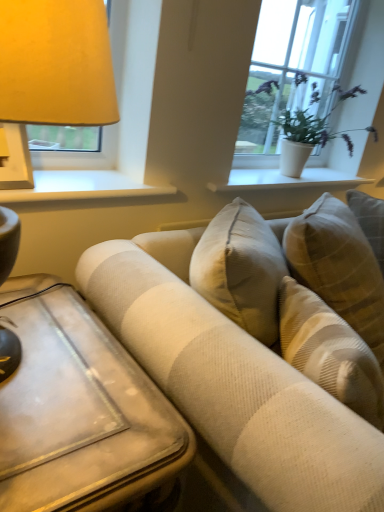
Question: Can you confirm if beige textured couch at center is shorter than white ceramic vase at upper center, which appears as the 1th window sill when viewed from the right?

Choices:
 (A) yes
 (B) no

Answer: (B)

Question: Is beige textured couch at center further to camera compared to white ceramic vase at upper center, the 2th window sill viewed from the front?

Choices:
 (A) yes
 (B) no

Answer: (B)

Question: Can you see beige textured couch at center touching white ceramic vase at upper center, marked as the first window sill in a back-to-front arrangement?

Choices:
 (A) no
 (B) yes

Answer: (A)

Question: Considering the relative positions of beige textured couch at center and white ceramic vase at upper center, the 2th window sill viewed from the front, in the image provided, is beige textured couch at center to the left of white ceramic vase at upper center, the 2th window sill viewed from the front, from the viewer's perspective?

Choices:
 (A) yes
 (B) no

Answer: (B)

Question: Is beige textured couch at center positioned in front of white ceramic vase at upper center, which is the second window sill in left-to-right order?

Choices:
 (A) yes
 (B) no

Answer: (A)

Question: Looking at their shapes, would you say white textured plant at upper right is wider or thinner than beige textured couch at center?

Choices:
 (A) thin
 (B) wide

Answer: (A)

Question: Is point coord(269,130) closer or farther from the camera than point coord(107,304)?

Choices:
 (A) closer
 (B) farther

Answer: (B)

Question: Based on their positions, is white textured plant at upper right located to the left or right of beige textured couch at center?

Choices:
 (A) left
 (B) right

Answer: (A)

Question: From the image's perspective, is white textured plant at upper right located above or below beige textured couch at center?

Choices:
 (A) above
 (B) below

Answer: (A)

Question: In terms of width, does white textured plant at upper right look wider or thinner when compared to white ceramic vase at upper center, marked as the first window sill in a back-to-front arrangement?

Choices:
 (A) thin
 (B) wide

Answer: (A)

Question: From their relative heights in the image, would you say white textured plant at upper right is taller or shorter than white ceramic vase at upper center, the 2th window sill viewed from the front?

Choices:
 (A) short
 (B) tall

Answer: (B)

Question: Relative to white ceramic vase at upper center, the 2th window sill viewed from the front, is white textured plant at upper right in front or behind?

Choices:
 (A) behind
 (B) front

Answer: (A)

Question: In the image, is white textured plant at upper right on the left side or the right side of white ceramic vase at upper center, the 2th window sill viewed from the front?

Choices:
 (A) left
 (B) right

Answer: (B)

Question: Is wooden table at lower left taller or shorter than beige textured couch at center?

Choices:
 (A) tall
 (B) short

Answer: (B)

Question: Relative to beige textured couch at center, is wooden table at lower left in front or behind?

Choices:
 (A) front
 (B) behind

Answer: (B)